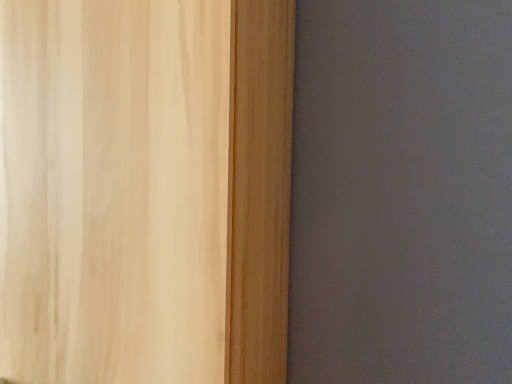
The width and height of the screenshot is (512, 384). Describe the element at coordinates (145, 190) in the screenshot. I see `light wood door at left` at that location.

Where is `light wood door at left`? light wood door at left is located at coordinates (145, 190).

Find the location of `light wood door at left`. light wood door at left is located at coordinates (145, 190).